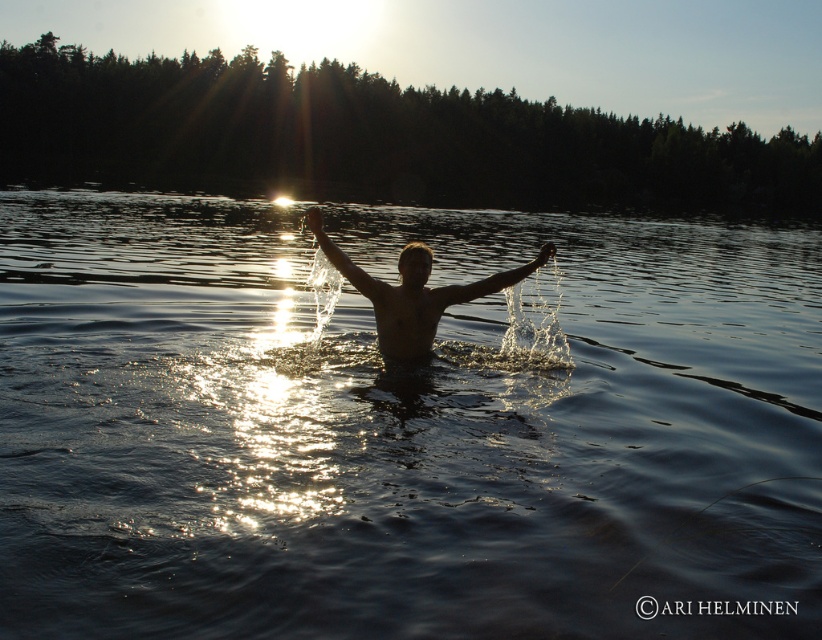
Question: Can you confirm if dark liquid water at center is positioned above silhouette skin person at center?

Choices:
 (A) no
 (B) yes

Answer: (B)

Question: Does dark liquid water at center have a greater width compared to silhouette skin person at center?

Choices:
 (A) yes
 (B) no

Answer: (A)

Question: Is dark liquid water at center bigger than silhouette skin person at center?

Choices:
 (A) yes
 (B) no

Answer: (A)

Question: Among these objects, which one is nearest to the camera?

Choices:
 (A) silhouette skin person at center
 (B) dark liquid water at center

Answer: (B)